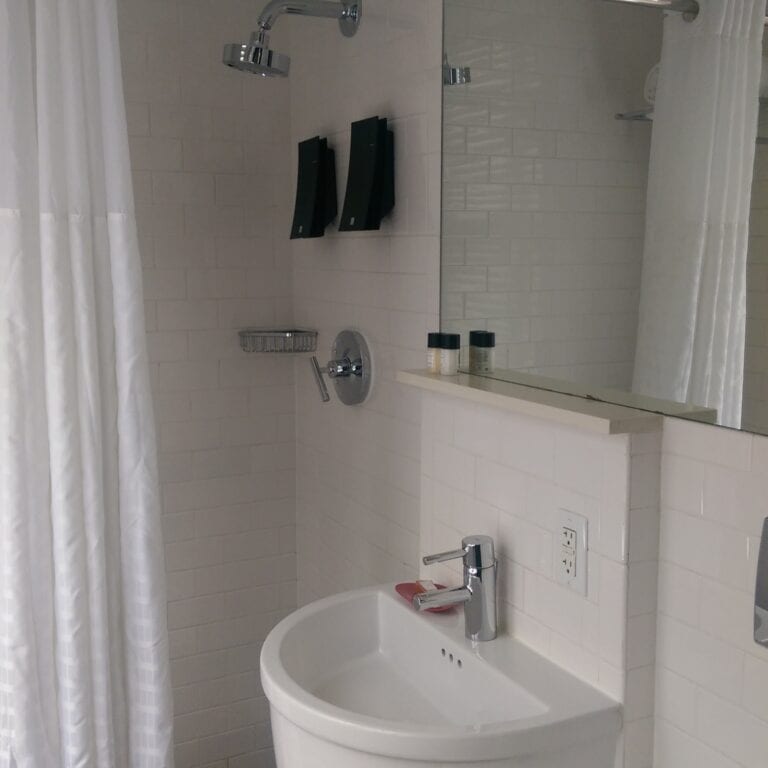
Identify the location of white socket. Image resolution: width=768 pixels, height=768 pixels. (564, 548).